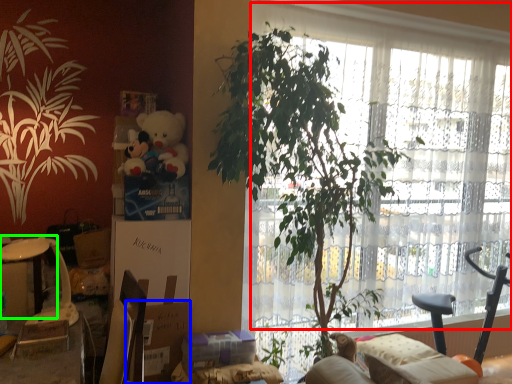
Question: Based on their relative distances, which object is farther from window frame (highlighted by a red box)? Choose from cardboard box (highlighted by a blue box) and table (highlighted by a green box).

Choices:
 (A) cardboard box
 (B) table

Answer: (B)